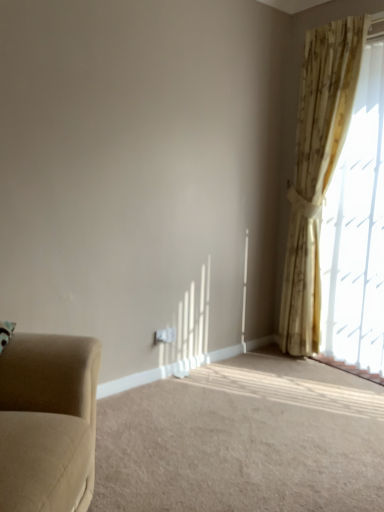
What do you see at coordinates (243, 440) in the screenshot? The height and width of the screenshot is (512, 384). I see `suede-like beige armchair at lower left` at bounding box center [243, 440].

Locate an element on the screen. The height and width of the screenshot is (512, 384). beige fabric studio couch at left is located at coordinates (48, 422).

Locate an element on the screen. beige floral curtain at upper right is located at coordinates (317, 170).

Based on the photo, how different are the orientations of beige fabric studio couch at left and suede-like beige armchair at lower left in degrees?

137 degrees.

Does point (9, 469) lie behind point (359, 417)?

No, (9, 469) is in front of (359, 417).

Considering the sizes of beige fabric studio couch at left and suede-like beige armchair at lower left in the image, is beige fabric studio couch at left wider or thinner than suede-like beige armchair at lower left?

Considering their sizes, beige fabric studio couch at left looks slimmer than suede-like beige armchair at lower left.

Which of these two, beige fabric studio couch at left or suede-like beige armchair at lower left, is bigger?

With larger size is beige fabric studio couch at left.

Can you confirm if suede-like beige armchair at lower left is positioned to the left of beige fabric studio couch at left?

No, suede-like beige armchair at lower left is not to the left of beige fabric studio couch at left.

Considering the sizes of suede-like beige armchair at lower left and beige fabric studio couch at left in the image, is suede-like beige armchair at lower left wider or thinner than beige fabric studio couch at left?

Considering their sizes, suede-like beige armchair at lower left looks broader than beige fabric studio couch at left.

From the image's perspective, is suede-like beige armchair at lower left over beige fabric studio couch at left?

No, from the image's perspective, suede-like beige armchair at lower left is not over beige fabric studio couch at left.

Is point (370, 402) closer to camera compared to point (45, 500)?

No.

Is suede-like beige armchair at lower left bigger than beige floral curtain at upper right?

Actually, suede-like beige armchair at lower left might be smaller than beige floral curtain at upper right.

Is suede-like beige armchair at lower left positioned beyond the bounds of beige floral curtain at upper right?

Yes, suede-like beige armchair at lower left is located beyond the bounds of beige floral curtain at upper right.

Image resolution: width=384 pixels, height=512 pixels. What are the coordinates of `plain that is below the beige floral curtain at upper right (from the image's perspective)` in the screenshot? It's located at (243, 440).

Can you confirm if beige floral curtain at upper right is bigger than suede-like beige armchair at lower left?

Indeed, beige floral curtain at upper right has a larger size compared to suede-like beige armchair at lower left.

Does beige floral curtain at upper right have a greater height compared to suede-like beige armchair at lower left?

Indeed, beige floral curtain at upper right has a greater height compared to suede-like beige armchair at lower left.

Which point is more distant from viewer, [333,170] or [211,378]?

Point [333,170]

Which is correct: beige floral curtain at upper right is inside suede-like beige armchair at lower left, or outside of it?

The correct answer is: outside.

Is beige fabric studio couch at left wider or thinner than beige floral curtain at upper right?

In the image, beige fabric studio couch at left appears to be wider than beige floral curtain at upper right.

Where is `curtain on the right of beige fabric studio couch at left`? This screenshot has height=512, width=384. curtain on the right of beige fabric studio couch at left is located at coordinates (317, 170).

Based on the photo, from a real-world perspective, is beige fabric studio couch at left above or below beige floral curtain at upper right?

beige fabric studio couch at left is below beige floral curtain at upper right.

Is beige floral curtain at upper right bigger than beige fabric studio couch at left?

Actually, beige floral curtain at upper right might be smaller than beige fabric studio couch at left.

Is beige floral curtain at upper right at the left side of beige fabric studio couch at left?

Incorrect, beige floral curtain at upper right is not on the left side of beige fabric studio couch at left.

Is beige floral curtain at upper right inside the boundaries of beige fabric studio couch at left, or outside?

beige floral curtain at upper right exists outside the volume of beige fabric studio couch at left.

Is beige floral curtain at upper right not close to beige fabric studio couch at left?

Indeed, beige floral curtain at upper right is not near beige fabric studio couch at left.

Locate an element on the screen. This screenshot has width=384, height=512. plain beneath the beige fabric studio couch at left (from a real-world perspective) is located at coordinates (243, 440).

Find the location of a particular element. plain on the right of beige fabric studio couch at left is located at coordinates (243, 440).

Looking at the image, which one is located closer to beige floral curtain at upper right, suede-like beige armchair at lower left or beige fabric studio couch at left?

The object closer to beige floral curtain at upper right is suede-like beige armchair at lower left.

In the scene shown: Estimate the real-world distances between objects in this image. Which object is closer to beige fabric studio couch at left, beige floral curtain at upper right or suede-like beige armchair at lower left?

suede-like beige armchair at lower left lies closer to beige fabric studio couch at left than the other object.

Looking at the image, which one is located further to beige floral curtain at upper right, beige fabric studio couch at left or suede-like beige armchair at lower left?

The object further to beige floral curtain at upper right is beige fabric studio couch at left.

Looking at the image, which one is located further to beige fabric studio couch at left, suede-like beige armchair at lower left or beige floral curtain at upper right?

beige floral curtain at upper right lies further to beige fabric studio couch at left than the other object.

Consider the image. Which object lies nearer to the anchor point suede-like beige armchair at lower left, beige floral curtain at upper right or beige fabric studio couch at left?

beige fabric studio couch at left lies closer to suede-like beige armchair at lower left than the other object.

From the image, which object appears to be farther from suede-like beige armchair at lower left, beige fabric studio couch at left or beige floral curtain at upper right?

beige floral curtain at upper right lies further to suede-like beige armchair at lower left than the other object.

The width and height of the screenshot is (384, 512). I want to click on plain between beige fabric studio couch at left and beige floral curtain at upper right along the z-axis, so click(243, 440).